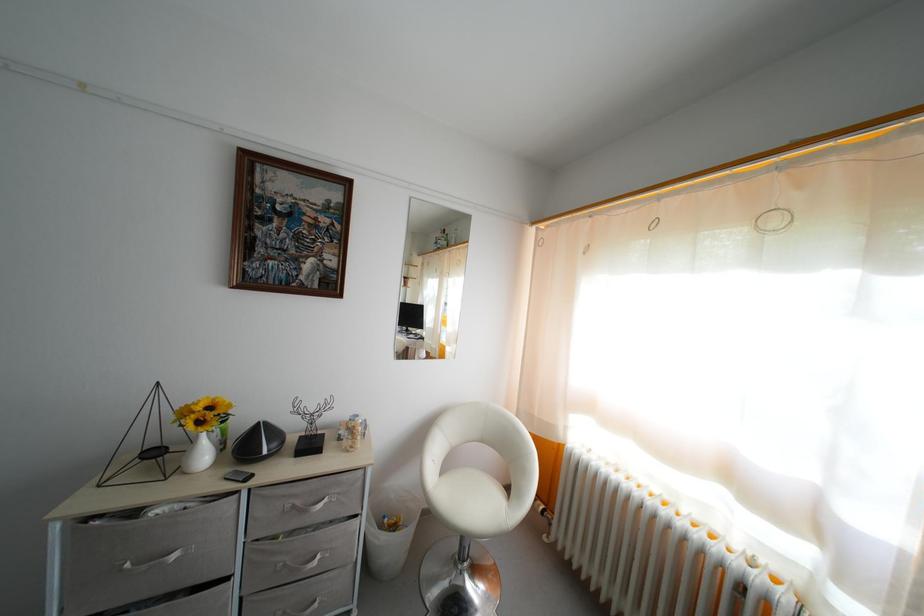
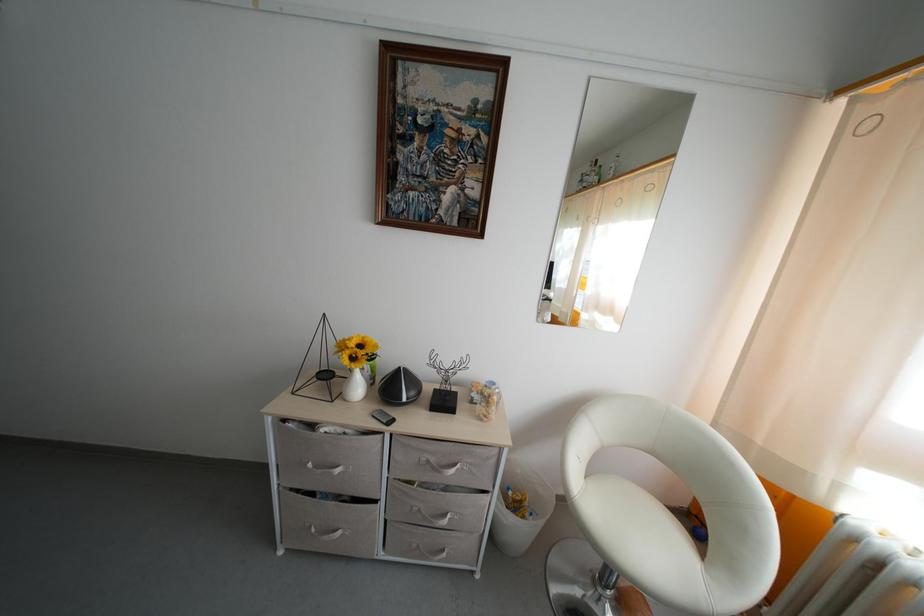
Where in the second image is the point corresponding to (290,570) from the first image?

(426, 517)